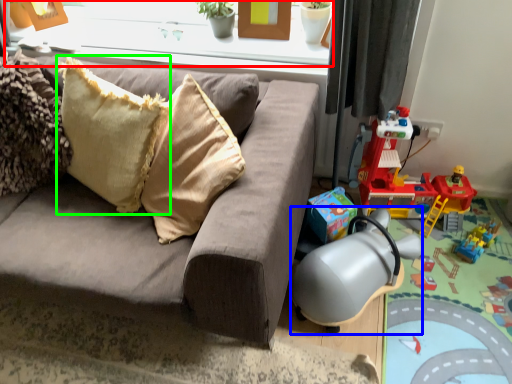
Question: Which object is the closest to the window frame (highlighted by a red box)? Choose among these: swivel chair (highlighted by a blue box) or pillow (highlighted by a green box).

Choices:
 (A) swivel chair
 (B) pillow

Answer: (B)